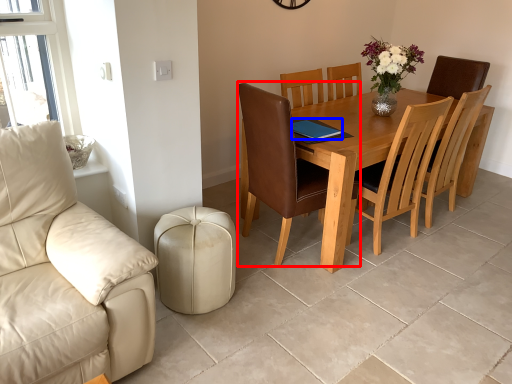
Question: Which object appears closest to the camera in this image, chair (highlighted by a red box) or pad (highlighted by a blue box)?

Choices:
 (A) chair
 (B) pad

Answer: (A)